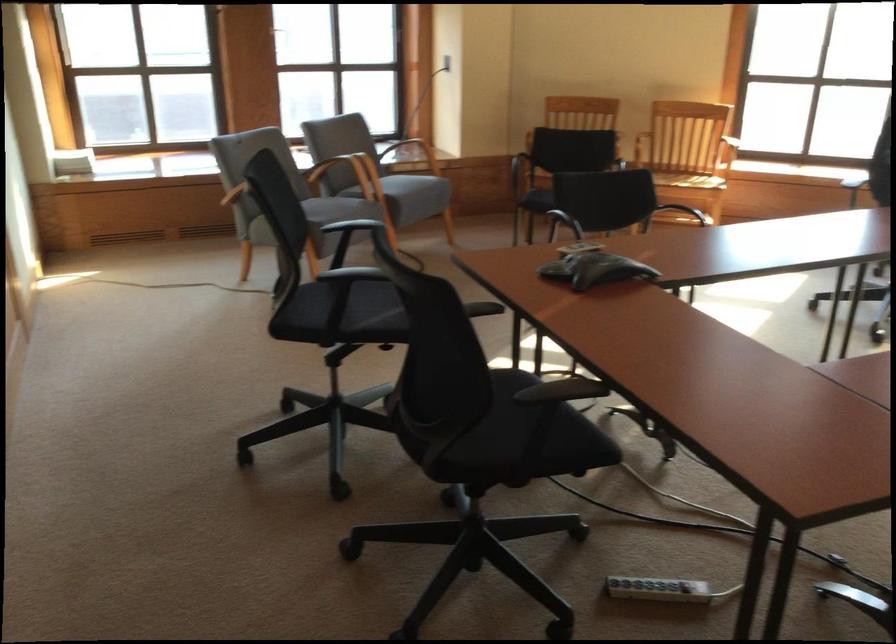
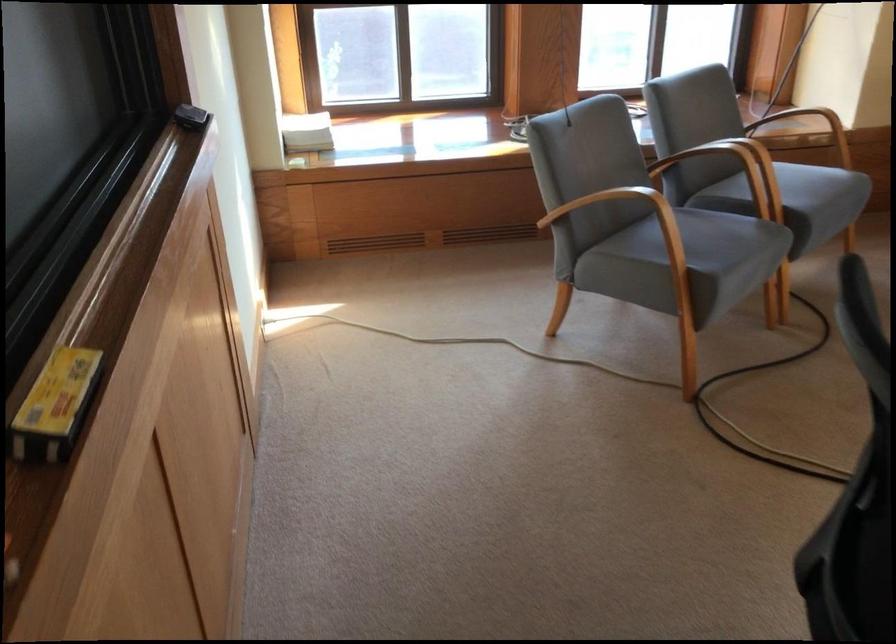
The images are taken continuously from a first-person perspective. In which direction are you moving?

The movement direction of the cameraman is left, forward.